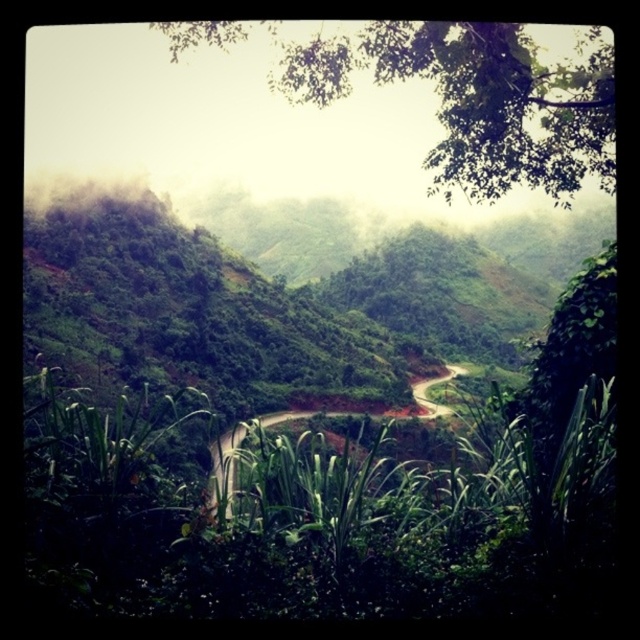
Consider the image. You are a hiker standing at the bottom of the hill. You see a green leafy tree at upper center. Based on its position, can you estimate how far it is from the top of the hill?

The green leafy tree at upper center is positioned at point 0.158 on the x axis and 0.750 on the y axis. Since the y axis measures vertical distance from the bottom of the hill, the tree is located 0.750 units away from the bottom. To estimate distance from the top, subtract this value from 1, resulting in approximately 0.25 units distance from the top.